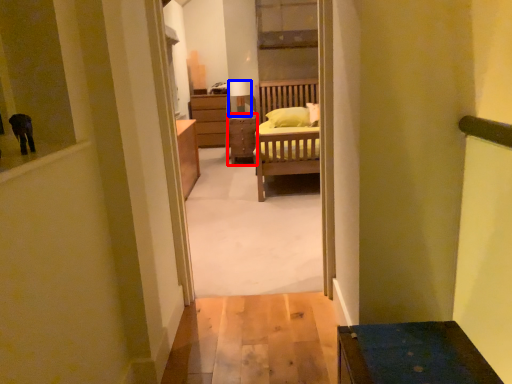
Question: Which object appears closest to the camera in this image, table (highlighted by a red box) or lamp (highlighted by a blue box)?

Choices:
 (A) table
 (B) lamp

Answer: (A)